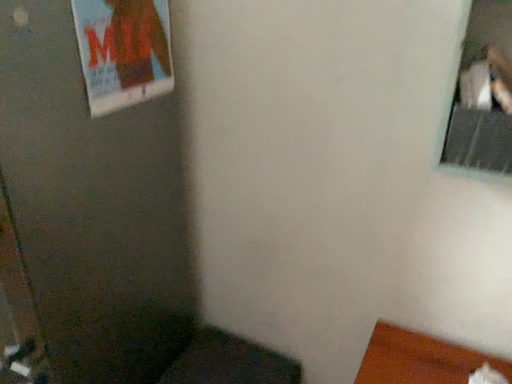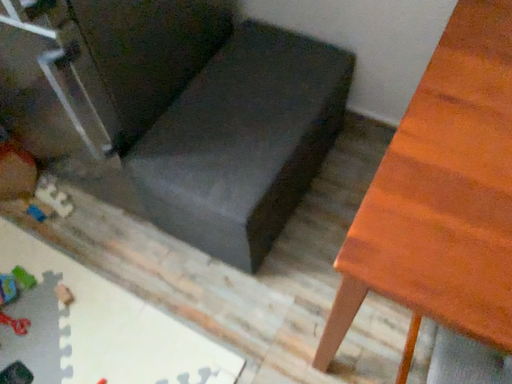
Question: How did the camera likely rotate when shooting the video?

Choices:
 (A) rotated upward
 (B) rotated downward

Answer: (B)